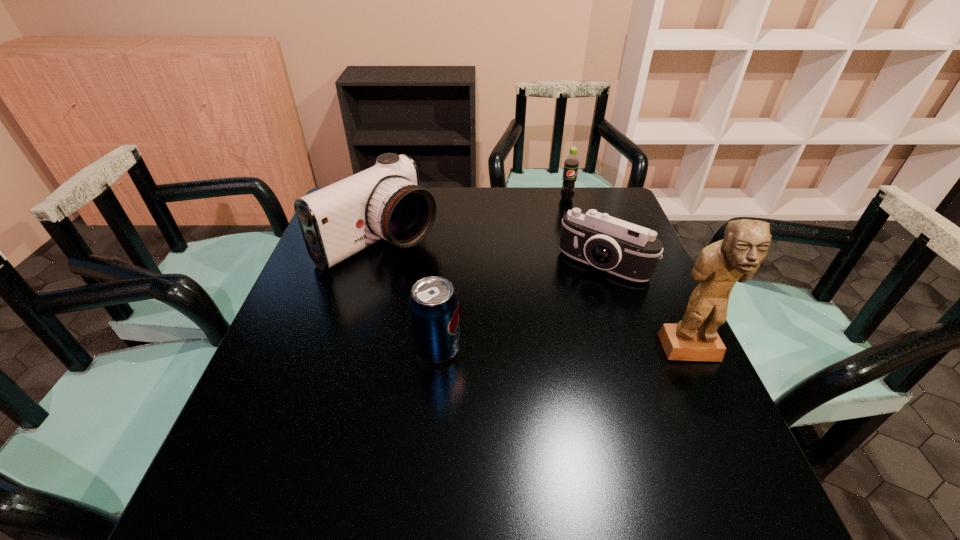
Where is `vacant space situated on the front label of the right soda`? vacant space situated on the front label of the right soda is located at coordinates (568, 216).

You are a GUI agent. You are given a task and a screenshot of the screen. Output one action in this format:
    pyautogui.click(x=<x>, y=<y>)
    Task: Click on the free space located 0.140m on the front lens of the camera
    The width and height of the screenshot is (960, 540).
    Given the screenshot: What is the action you would take?
    pyautogui.click(x=560, y=314)

Where is `blank space located on the front lens of the camera`? blank space located on the front lens of the camera is located at coordinates (540, 341).

Locate an element on the screen. This screenshot has width=960, height=540. blank space located on the front lens of the camera is located at coordinates (556, 320).

Locate an element on the screen. This screenshot has width=960, height=540. free location located 0.090m on the surface of the camcorder is located at coordinates (443, 278).

Find the location of a particular element. The width and height of the screenshot is (960, 540). free space located 0.140m on the surface of the camcorder is located at coordinates (456, 287).

In order to click on free space located 0.160m on the surface of the camcorder in this screenshot , I will do click(x=462, y=290).

I want to click on soda that is at the far edge, so click(x=571, y=163).

You are a GUI agent. You are given a task and a screenshot of the screen. Output one action in this format:
    pyautogui.click(x=<x>, y=<y>)
    Task: Click on the camcorder at the far edge
    
    Given the screenshot: What is the action you would take?
    pyautogui.click(x=386, y=201)

This screenshot has width=960, height=540. I want to click on object that is at the left edge, so click(386, 201).